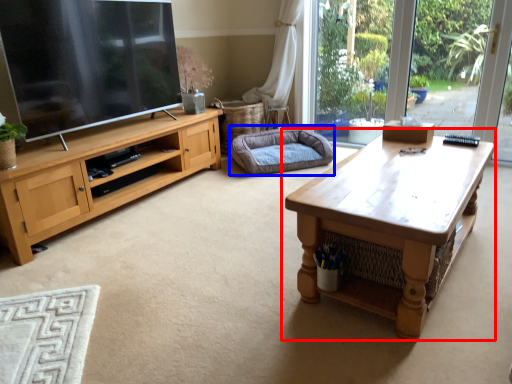
Question: Which point is further to the camera, coffee table (highlighted by a red box) or dog bed (highlighted by a blue box)?

Choices:
 (A) coffee table
 (B) dog bed

Answer: (B)